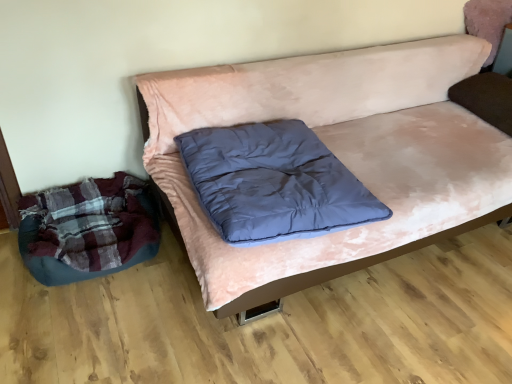
Question: From a real-world perspective, relative to pink velvety couch at center, is dark blue down at center vertically above or below?

Choices:
 (A) below
 (B) above

Answer: (B)

Question: Is point (274, 193) closer or farther from the camera than point (434, 188)?

Choices:
 (A) closer
 (B) farther

Answer: (A)

Question: Considering the real-world distances, which object is closest to the plush dark blue bean bag at lower left?

Choices:
 (A) dark blue down at center
 (B) pink velvety couch at center

Answer: (A)

Question: Considering the real-world distances, which object is farthest from the plush dark blue bean bag at lower left?

Choices:
 (A) dark blue down at center
 (B) pink velvety couch at center

Answer: (B)